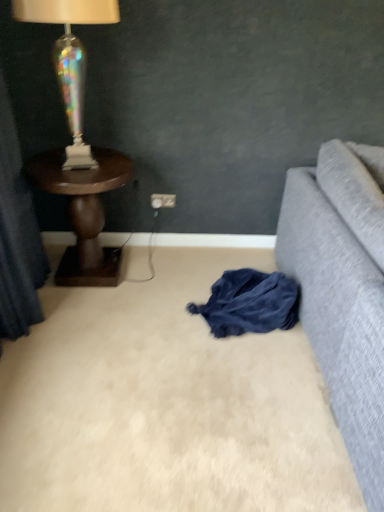
At what (x,y) coordinates should I click in order to perform the action: click on white plastic power outlet at center. Please return your answer as a coordinate pair (x, y). The image size is (384, 512). Looking at the image, I should click on (163, 201).

The width and height of the screenshot is (384, 512). Describe the element at coordinates (163, 201) in the screenshot. I see `white plastic power outlet at center` at that location.

The height and width of the screenshot is (512, 384). I want to click on iridescent glass lamp at upper left, so click(70, 60).

Find the location of a particular element. Image resolution: width=384 pixels, height=512 pixels. dark blue fabric at left is located at coordinates (17, 236).

Find the location of a particular element. The image size is (384, 512). white plastic power outlet at center is located at coordinates (163, 201).

Is dark blue fabric at lower center inside the boundaries of dark blue fabric at left, or outside?

dark blue fabric at lower center is outside dark blue fabric at left.

Is dark blue fabric at lower center beside dark blue fabric at left?

No, dark blue fabric at lower center is not with dark blue fabric at left.

From the image's perspective, is dark blue fabric at lower center on dark blue fabric at left?

No, from the image's perspective, dark blue fabric at lower center is not over dark blue fabric at left.

Which of these two, dark blue fabric at lower center or dark blue fabric at left, is thinner?

dark blue fabric at left is thinner.

How different are the orientations of white plastic power outlet at center and dark blue fabric at lower center in degrees?

They differ by 13.7 degrees in their facing directions.

From a real-world perspective, between white plastic power outlet at center and dark blue fabric at lower center, who is vertically lower?

In real-world perspective, dark blue fabric at lower center is lower.

Which of these two, white plastic power outlet at center or dark blue fabric at lower center, is wider?

With larger width is dark blue fabric at lower center.

Is white plastic power outlet at center touching dark blue fabric at lower center?

There is a gap between white plastic power outlet at center and dark blue fabric at lower center.

Looking at this image, can you tell me how much dark wood side table at left and dark blue fabric at left differ in facing direction?

89.8 degrees.

From a real-world perspective, which object rests below the other?

In real-world perspective, dark wood side table at left is lower.

Is dark wood side table at left positioned before dark blue fabric at left?

No.

Is dark wood side table at left directly adjacent to dark blue fabric at left?

No, dark wood side table at left is not next to dark blue fabric at left.

Considering the sizes of objects dark blue fabric at lower center and dark wood side table at left in the image provided, who is taller, dark blue fabric at lower center or dark wood side table at left?

dark wood side table at left.

Which is behind, point (249, 284) or point (89, 263)?

Point (89, 263)

From a real-world perspective, is dark blue fabric at lower center positioned above or below dark wood side table at left?

From a real-world perspective, dark blue fabric at lower center is physically below dark wood side table at left.

Measure the distance from dark blue fabric at lower center to dark wood side table at left.

A distance of 30.98 inches exists between dark blue fabric at lower center and dark wood side table at left.

How far apart are white plastic power outlet at center and dark blue fabric at left?

35.99 inches.

Is white plastic power outlet at center smaller than dark blue fabric at left?

Yes.

From the image's perspective, which one is positioned lower, white plastic power outlet at center or dark blue fabric at left?

dark blue fabric at left, from the image's perspective.

Does white plastic power outlet at center contain dark blue fabric at left?

No, dark blue fabric at left is not surrounded by white plastic power outlet at center.

Are dark blue fabric at left and iridescent glass lamp at upper left far apart?

No, dark blue fabric at left is in close proximity to iridescent glass lamp at upper left.

Who is smaller, dark blue fabric at left or iridescent glass lamp at upper left?

Smaller between the two is iridescent glass lamp at upper left.

Considering the relative sizes of dark blue fabric at left and iridescent glass lamp at upper left in the image provided, is dark blue fabric at left wider than iridescent glass lamp at upper left?

Incorrect, the width of dark blue fabric at left does not surpass that of iridescent glass lamp at upper left.

Between point (24, 7) and point (86, 199), which one is positioned behind?

The point (86, 199) is farther from the camera.

Consider the image. Is dark wood side table at left inside iridescent glass lamp at upper left?

No.

From the image's perspective, is iridescent glass lamp at upper left over dark wood side table at left?

Yes.

Locate an element on the screen. curtain on the left of dark blue fabric at lower center is located at coordinates (17, 236).

Locate an element on the screen. The image size is (384, 512). clothing that is in front of the white plastic power outlet at center is located at coordinates (250, 303).

Considering their positions, is white plastic power outlet at center positioned further to dark wood side table at left than dark blue fabric at left?

Among the two, white plastic power outlet at center is located further to dark wood side table at left.

Which object lies nearer to the anchor point white plastic power outlet at center, dark blue fabric at left or dark wood side table at left?

The object closer to white plastic power outlet at center is dark wood side table at left.

When comparing their distances from dark wood side table at left, does iridescent glass lamp at upper left or white plastic power outlet at center seem closer?

Based on the image, iridescent glass lamp at upper left appears to be nearer to dark wood side table at left.

From the image, which object appears to be farther from dark blue fabric at lower center, dark wood side table at left or dark blue fabric at left?

dark blue fabric at left.

Considering their positions, is white plastic power outlet at center positioned closer to dark blue fabric at left than dark wood side table at left?

The object closer to dark blue fabric at left is dark wood side table at left.

From the picture: Which object lies nearer to the anchor point dark wood side table at left, dark blue fabric at left or dark blue fabric at lower center?

The object closer to dark wood side table at left is dark blue fabric at left.

Considering their positions, is dark blue fabric at lower center positioned further to dark blue fabric at left than white plastic power outlet at center?

Among the two, dark blue fabric at lower center is located further to dark blue fabric at left.

Looking at the image, which one is located closer to dark blue fabric at left, iridescent glass lamp at upper left or dark wood side table at left?

Based on the image, dark wood side table at left appears to be nearer to dark blue fabric at left.

Where is `lamp between dark blue fabric at left and dark blue fabric at lower center`? Image resolution: width=384 pixels, height=512 pixels. lamp between dark blue fabric at left and dark blue fabric at lower center is located at coordinates (70, 60).

Locate an element on the screen. Image resolution: width=384 pixels, height=512 pixels. clothing between iridescent glass lamp at upper left and white plastic power outlet at center from front to back is located at coordinates (250, 303).

You are a GUI agent. You are given a task and a screenshot of the screen. Output one action in this format:
    pyautogui.click(x=<x>, y=<y>)
    Task: Click on the table between iridescent glass lamp at upper left and white plastic power outlet at center along the z-axis
    
    Given the screenshot: What is the action you would take?
    pyautogui.click(x=84, y=212)

What are the coordinates of `table situated between dark blue fabric at left and dark blue fabric at lower center from left to right` in the screenshot? It's located at (84, 212).